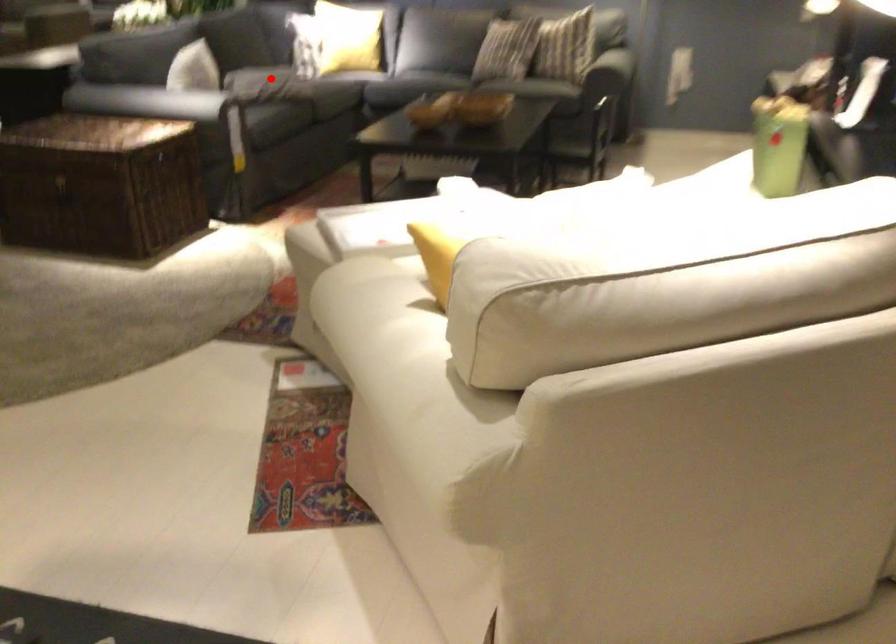
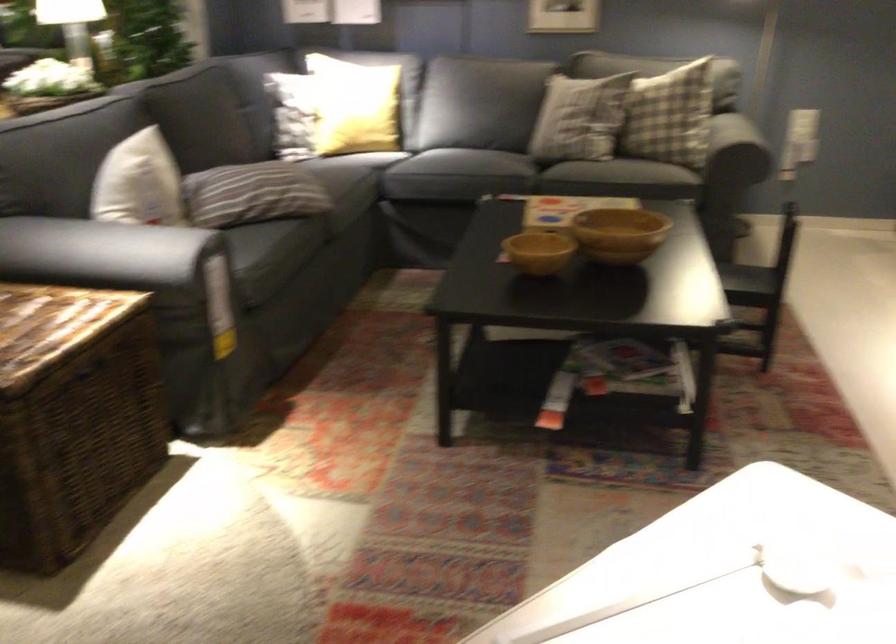
In the second image, find the point that corresponds to the highlighted location in the first image.

(261, 194)